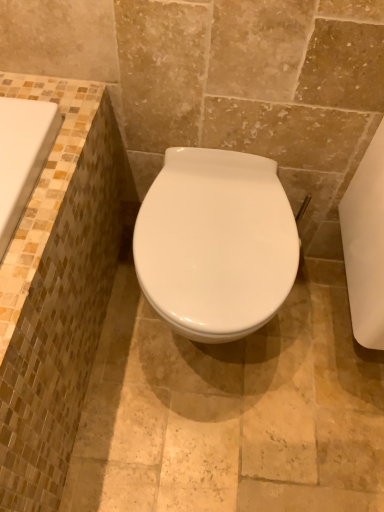
What do you see at coordinates (216, 243) in the screenshot? I see `white glossy toilet at center` at bounding box center [216, 243].

Measure the distance between white glossy toilet at center and camera.

The distance of white glossy toilet at center from camera is 32.73 inches.

What is the approximate height of white glossy toilet at center?

white glossy toilet at center is 18.87 inches in height.

Image resolution: width=384 pixels, height=512 pixels. I want to click on white glossy toilet at center, so (216, 243).

In order to face white glossy toilet at center, should I rotate leftwards or rightwards?

Turn right by 2.741 degrees to look at white glossy toilet at center.

Measure the distance between point [193,337] and camera.

The depth of point [193,337] is 34.13 inches.

You are a GUI agent. You are given a task and a screenshot of the screen. Output one action in this format:
    pyautogui.click(x=<x>, y=<y>)
    Task: Click on the white glossy toilet at center
    This screenshot has width=384, height=512.
    Given the screenshot: What is the action you would take?
    pyautogui.click(x=216, y=243)